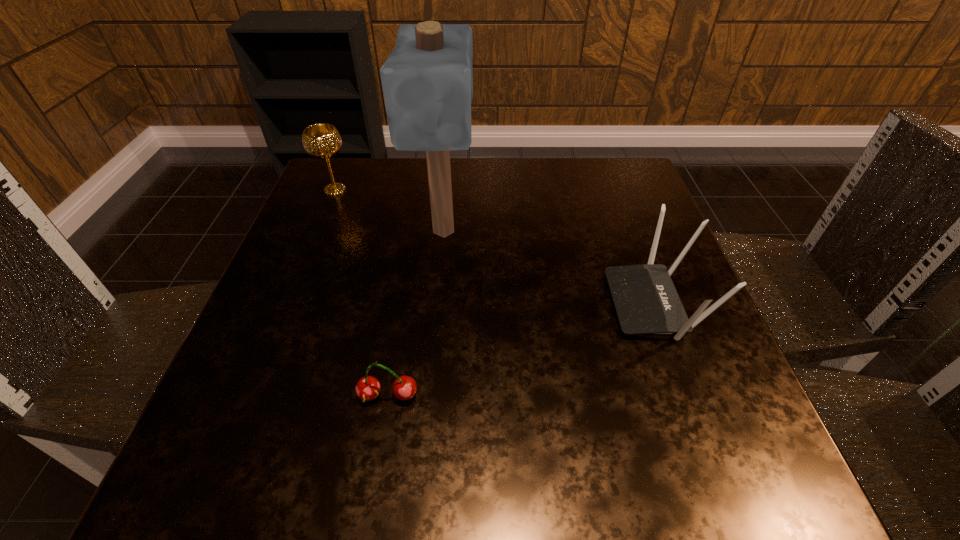
This screenshot has height=540, width=960. I want to click on free spot between the tallest object and the chalice, so click(x=390, y=211).

Locate an element on the screen. The width and height of the screenshot is (960, 540). vacant space in between the leftmost object and the mallet is located at coordinates (390, 211).

The image size is (960, 540). What are the coordinates of `vacant region between the nearest object and the mallet` in the screenshot? It's located at (416, 314).

Where is `vacant space in between the leftmost object and the tallest object`? The width and height of the screenshot is (960, 540). vacant space in between the leftmost object and the tallest object is located at coordinates (390, 211).

I want to click on vacant point located between the mallet and the rightmost object, so click(x=549, y=267).

This screenshot has height=540, width=960. I want to click on object that can be found as the closest to the nearest object, so [427, 80].

Where is `object that is the second nearest to the cherry`? The image size is (960, 540). object that is the second nearest to the cherry is located at coordinates (646, 302).

This screenshot has width=960, height=540. Identify the location of free space that satisfies the following two spatial constraints: 1. on the front-facing side of the router; 2. with stems pointing upwards on the cherry. (689, 396).